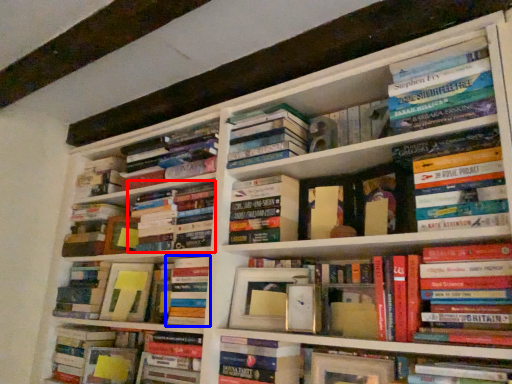
Question: Among these objects, which one is nearest to the camera, book (highlighted by a red box) or book (highlighted by a blue box)?

Choices:
 (A) book
 (B) book

Answer: (B)